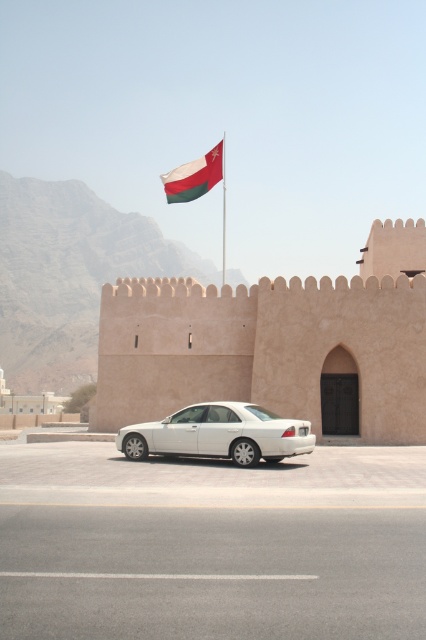
You are standing in front of the building and want to take a photo of both the matte beige wall at center and the white glossy sedan at center. Which object should you position to the left side of your camera frame to include both in the photo?

To include both the matte beige wall at center and the white glossy sedan at center in your photo, position the white glossy sedan at center on the left side of your camera frame since the matte beige wall at center is to the right of it.